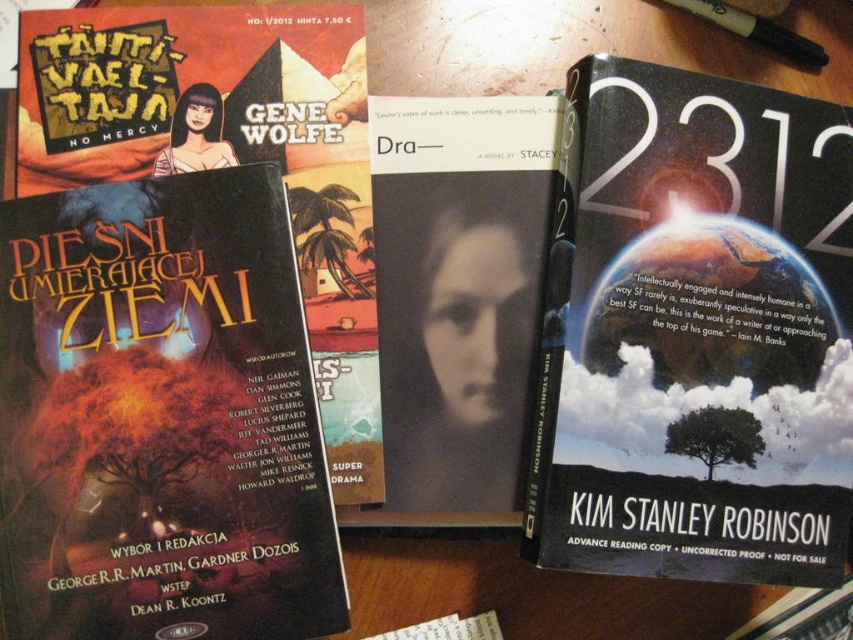
Who is positioned more to the right, hardcover book at right or dark matte book cover at left?

hardcover book at right is more to the right.

Does hardcover book at right appear over dark matte book cover at left?

Indeed, hardcover book at right is positioned over dark matte book cover at left.

You are a GUI agent. You are given a task and a screenshot of the screen. Output one action in this format:
    pyautogui.click(x=<x>, y=<y>)
    Task: Click on the hardcover book at right
    The width and height of the screenshot is (853, 640).
    Given the screenshot: What is the action you would take?
    pyautogui.click(x=695, y=332)

Is matte black book at center below black matte book at center?

Incorrect, matte black book at center is not positioned below black matte book at center.

What do you see at coordinates (228, 154) in the screenshot? I see `matte black book at center` at bounding box center [228, 154].

Image resolution: width=853 pixels, height=640 pixels. In order to click on matte black book at center in this screenshot , I will do `click(228, 154)`.

Which is below, hardcover book at right or matte black book at center?

hardcover book at right

The width and height of the screenshot is (853, 640). What are the coordinates of `hardcover book at right` in the screenshot? It's located at (695, 332).